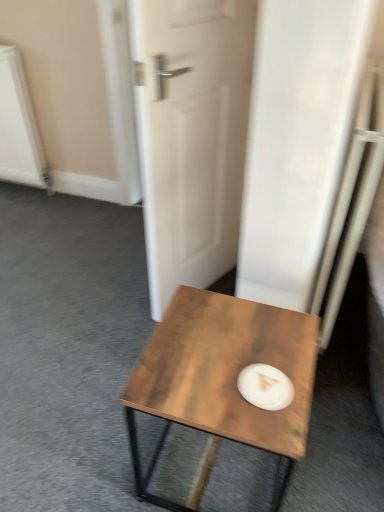
This screenshot has width=384, height=512. In order to click on empty space that is ontop of wooden coffee table at center (from a real-world perspective) in this screenshot , I will do `click(218, 356)`.